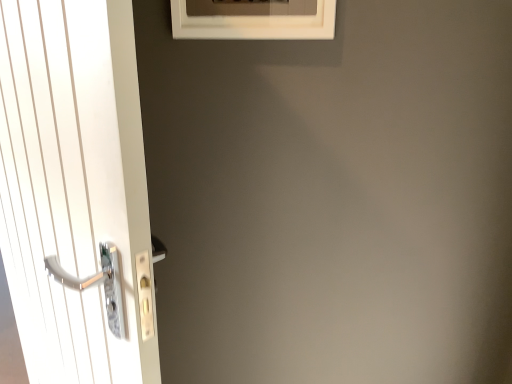
Question: Considering the positions of point [x=295, y=26] and point [x=78, y=178], is point [x=295, y=26] closer or farther from the camera than point [x=78, y=178]?

Choices:
 (A) farther
 (B) closer

Answer: (A)

Question: Considering the positions of white matte frame at upper center and white glossy door handle at left in the image, is white matte frame at upper center wider or thinner than white glossy door handle at left?

Choices:
 (A) thin
 (B) wide

Answer: (A)

Question: Is white matte frame at upper center inside or outside of white glossy door handle at left?

Choices:
 (A) outside
 (B) inside

Answer: (A)

Question: Is white glossy door handle at left taller or shorter than white matte frame at upper center?

Choices:
 (A) short
 (B) tall

Answer: (B)

Question: Is white glossy door handle at left spatially inside white matte frame at upper center, or outside of it?

Choices:
 (A) inside
 (B) outside

Answer: (B)

Question: In terms of width, does white glossy door handle at left look wider or thinner when compared to white matte frame at upper center?

Choices:
 (A) thin
 (B) wide

Answer: (B)

Question: Is point (116, 244) closer or farther from the camera than point (223, 21)?

Choices:
 (A) farther
 (B) closer

Answer: (B)